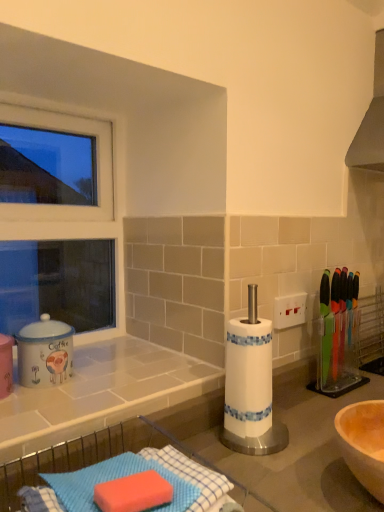
Question: Considering the relative sizes of white plastic window frame at upper left and matte ceramic coffee canister at left in the image provided, is white plastic window frame at upper left wider than matte ceramic coffee canister at left?

Choices:
 (A) yes
 (B) no

Answer: (B)

Question: Can you confirm if white plastic window frame at upper left is positioned to the left of matte ceramic coffee canister at left?

Choices:
 (A) no
 (B) yes

Answer: (B)

Question: Is matte ceramic coffee canister at left at the back of white plastic window frame at upper left?

Choices:
 (A) no
 (B) yes

Answer: (A)

Question: From the image's perspective, is white plastic window frame at upper left over matte ceramic coffee canister at left?

Choices:
 (A) yes
 (B) no

Answer: (A)

Question: From the image's perspective, does white plastic window frame at upper left appear lower than matte ceramic coffee canister at left?

Choices:
 (A) no
 (B) yes

Answer: (A)

Question: From the image's perspective, is matte ceramic coffee canister at left positioned above or below blue textured sponge at lower left, the 2th countertop from the top?

Choices:
 (A) above
 (B) below

Answer: (A)

Question: In terms of size, does matte ceramic coffee canister at left appear bigger or smaller than blue textured sponge at lower left, placed as the first countertop when sorted from bottom to top?

Choices:
 (A) small
 (B) big

Answer: (A)

Question: Is matte ceramic coffee canister at left taller or shorter than blue textured sponge at lower left, placed as the first countertop when sorted from bottom to top?

Choices:
 (A) tall
 (B) short

Answer: (A)

Question: Considering the positions of matte ceramic coffee canister at left and blue textured sponge at lower left, placed as the first countertop when sorted from bottom to top, in the image, is matte ceramic coffee canister at left wider or thinner than blue textured sponge at lower left, placed as the first countertop when sorted from bottom to top,?

Choices:
 (A) wide
 (B) thin

Answer: (B)

Question: Is blue textured sponge at lower left, the 2th countertop from the top, wider or thinner than matte ceramic coffee canister at left?

Choices:
 (A) wide
 (B) thin

Answer: (A)

Question: Considering the positions of blue textured sponge at lower left, the 2th countertop from the top, and matte ceramic coffee canister at left in the image, is blue textured sponge at lower left, the 2th countertop from the top, taller or shorter than matte ceramic coffee canister at left?

Choices:
 (A) tall
 (B) short

Answer: (B)

Question: From the image's perspective, is blue textured sponge at lower left, the 2th countertop from the top, above or below matte ceramic coffee canister at left?

Choices:
 (A) below
 (B) above

Answer: (A)

Question: Considering the relative positions of blue textured sponge at lower left, the 2th countertop from the top, and matte ceramic coffee canister at left in the image provided, is blue textured sponge at lower left, the 2th countertop from the top, to the left or to the right of matte ceramic coffee canister at left?

Choices:
 (A) right
 (B) left

Answer: (A)

Question: Is white plastic window frame at upper left to the left or to the right of white tile countertop at lower left, the 1th countertop viewed from the top, in the image?

Choices:
 (A) left
 (B) right

Answer: (A)

Question: Looking at the image, does white plastic window frame at upper left seem bigger or smaller compared to white tile countertop at lower left, the second countertop from the bottom?

Choices:
 (A) big
 (B) small

Answer: (A)